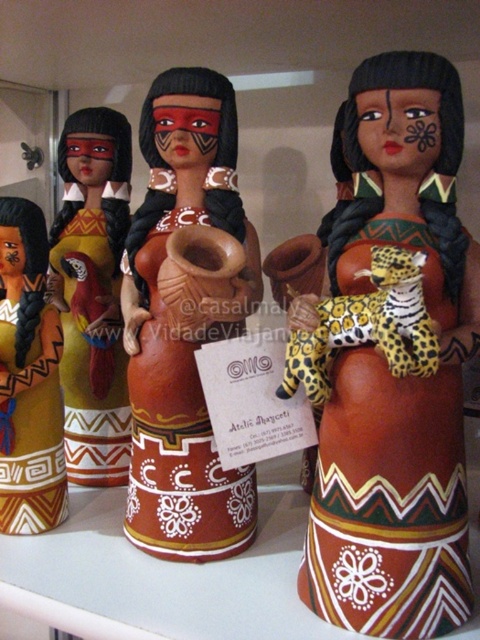
From the picture: You are an art curator organizing an exhibition and need to place the matte clay figure at center and the matte clay doll at center on a shelf. Which object should be placed first if you want the larger one to be more prominent?

The matte clay figure at center should be placed first since it is larger than the matte clay doll at center, making it more prominent when positioned properly.

You are an art curator examining the shelf with the four ceramic figurines. You need to place a new label for the matte clay figure at center. According to the coordinate system where the bottom left corner is the origin, what are the coordinates of this figure?

The coordinates of the matte clay figure at center are at point [388,371].